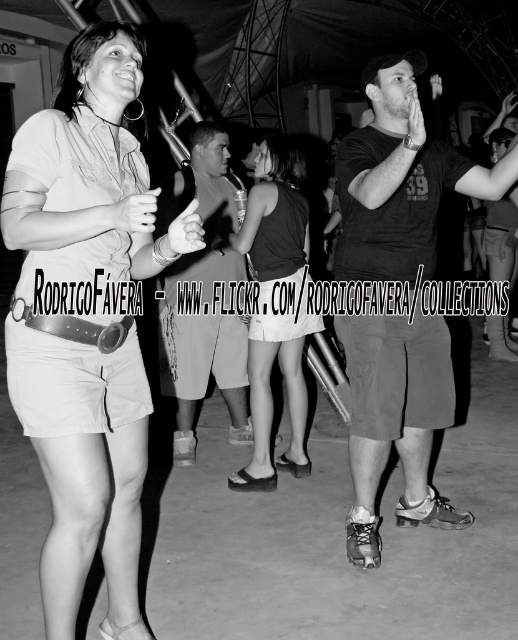
Question: Which point appears farthest from the camera in this image?

Choices:
 (A) (x=409, y=369)
 (B) (x=295, y=420)
 (C) (x=233, y=358)

Answer: (C)

Question: Estimate the real-world distances between objects in this image. Which object is closer to the smooth black dress at center?

Choices:
 (A) dark gray cotton t-shirt at center
 (B) matte khaki shorts at left
 (C) smooth gray shorts at center

Answer: (C)

Question: Does matte khaki shorts at left have a lesser width compared to smooth black dress at center?

Choices:
 (A) no
 (B) yes

Answer: (A)

Question: Which is farther from the matte khaki shorts at left?

Choices:
 (A) smooth gray shorts at center
 (B) dark gray cotton t-shirt at center

Answer: (A)

Question: Is matte khaki shorts at left to the right of dark gray cotton t-shirt at center from the viewer's perspective?

Choices:
 (A) yes
 (B) no

Answer: (B)

Question: Does dark gray cotton t-shirt at center have a smaller size compared to smooth black dress at center?

Choices:
 (A) yes
 (B) no

Answer: (B)